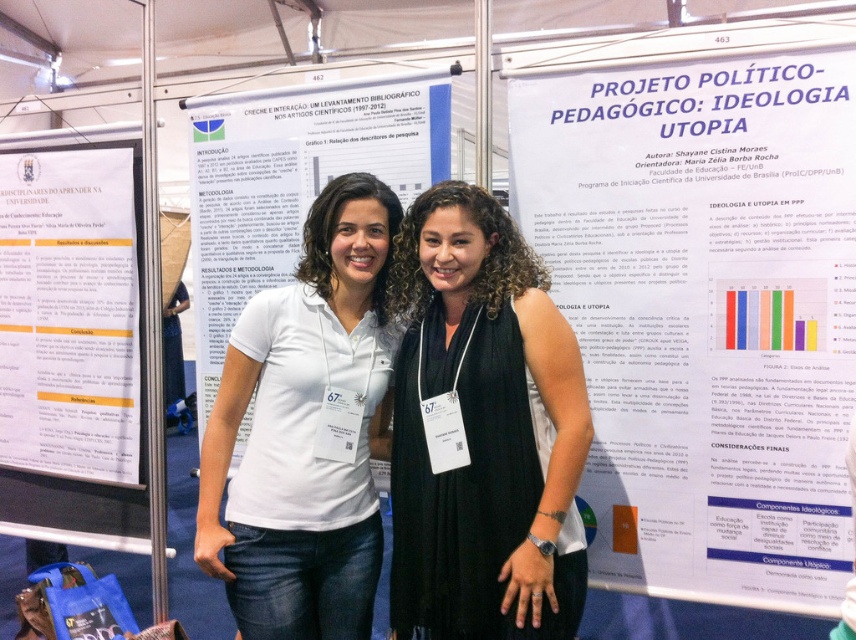
What is the spatial relationship between the black sleeveless dress at center and the white paper poster at left?

The black sleeveless dress at center is to the right of the white paper poster at left.

You are a photographer at the conference and need to capture both the black sleeveless dress at center and the woman on the left in the same frame. Can you position yourself so that both are fully visible without moving either subject?

The two subjects are 5.33 feet apart, so yes, you can position yourself to capture both the black sleeveless dress at center and the woman on the left in the same frame as they are within a reasonable distance for a standard camera lens.